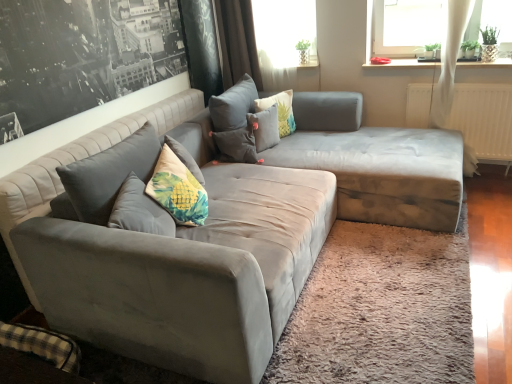
Question: Considering the positions of matte gray couch at upper left and fluffy fabric pillow at center, the second pillow positioned from the right, in the image, is matte gray couch at upper left bigger or smaller than fluffy fabric pillow at center, the second pillow positioned from the right,?

Choices:
 (A) small
 (B) big

Answer: (B)

Question: Is point (53, 69) closer or farther from the camera than point (267, 140)?

Choices:
 (A) closer
 (B) farther

Answer: (A)

Question: Estimate the real-world distances between objects in this image. Which object is closer to the floral fabric pillow at center, which is the 3th pillow in left-to-right order?

Choices:
 (A) white sheer curtain at upper center
 (B) fluffy fabric pillow at center, placed as the second pillow when sorted from left to right
 (C) suede gray couch at center
 (D) suede gray couch at center
 (E) brown velvet curtain at upper center

Answer: (B)

Question: Estimate the real-world distances between objects in this image. Which object is closer to the matte gray couch at upper left?

Choices:
 (A) suede gray couch at center
 (B) suede gray couch at center
 (C) brown velvet curtain at upper center
 (D) velvet floral pillow at center, which is the third pillow from right to left
 (E) floral fabric pillow at center, the 1th pillow from the right

Answer: (B)